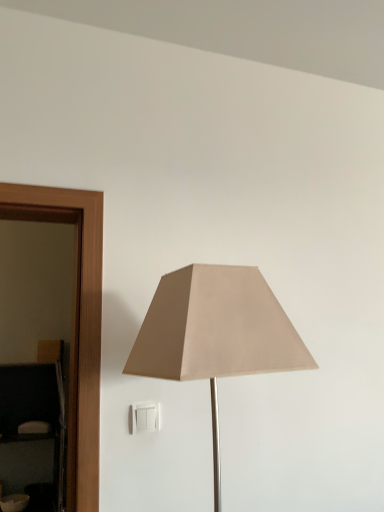
Question: From the image's perspective, is matte black dresser at left located above or below beige fabric lamp at center?

Choices:
 (A) above
 (B) below

Answer: (B)

Question: Do you think matte black dresser at left is within beige fabric lamp at center, or outside of it?

Choices:
 (A) outside
 (B) inside

Answer: (A)

Question: Estimate the real-world distances between objects in this image. Which object is closer to the beige fabric lamp at center?

Choices:
 (A) matte black dresser at left
 (B) white plastic/light switch at lower center

Answer: (B)

Question: Which object is the farthest from the beige fabric lamp at center?

Choices:
 (A) white plastic/light switch at lower center
 (B) matte black dresser at left

Answer: (B)